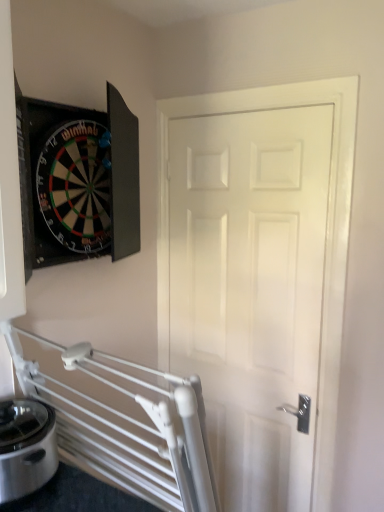
What is the approximate height of white glossy door at center?

The height of white glossy door at center is 6.07 feet.

Describe the element at coordinates (251, 291) in the screenshot. The height and width of the screenshot is (512, 384). I see `white glossy door at center` at that location.

Locate an element on the screen. The image size is (384, 512). white glossy door at center is located at coordinates (251, 291).

Find the location of `satin silver appliance at lower left`. satin silver appliance at lower left is located at coordinates (26, 447).

The height and width of the screenshot is (512, 384). Describe the element at coordinates (26, 447) in the screenshot. I see `satin silver appliance at lower left` at that location.

The image size is (384, 512). Identify the location of white glossy door at center. (251, 291).

Based on their positions, is white glossy door at center located to the left or right of satin silver appliance at lower left?

From the image, it's evident that white glossy door at center is to the right of satin silver appliance at lower left.

Which object is closer to the camera taking this photo, white glossy door at center or satin silver appliance at lower left?

Positioned in front is satin silver appliance at lower left.

Does point (268, 423) come farther from viewer compared to point (0, 499)?

Yes, it is.

From the image's perspective, is white glossy door at center under satin silver appliance at lower left?

Actually, white glossy door at center appears above satin silver appliance at lower left in the image.

From a real-world perspective, is white glossy door at center physically below satin silver appliance at lower left?

No.

Does white glossy door at center have a greater width compared to satin silver appliance at lower left?

In fact, white glossy door at center might be narrower than satin silver appliance at lower left.

In terms of height, does white glossy door at center look taller or shorter compared to satin silver appliance at lower left?

white glossy door at center is taller than satin silver appliance at lower left.

Consider the image. Can you confirm if white glossy door at center is bigger than satin silver appliance at lower left?

Yes, white glossy door at center is bigger than satin silver appliance at lower left.

Is white glossy door at center surrounding satin silver appliance at lower left?

No.

Is white glossy door at center beside satin silver appliance at lower left?

No, white glossy door at center is not next to satin silver appliance at lower left.

Is white glossy door at center oriented towards satin silver appliance at lower left?

Yes, white glossy door at center is oriented towards satin silver appliance at lower left.

How many degrees apart are the facing directions of white glossy door at center and satin silver appliance at lower left?

87.8 degrees.

Locate an element on the screen. The height and width of the screenshot is (512, 384). door that is above the satin silver appliance at lower left (from a real-world perspective) is located at coordinates (251, 291).

Which object is positioned more to the right, satin silver appliance at lower left or white glossy door at center?

white glossy door at center is more to the right.

Is satin silver appliance at lower left behind white glossy door at center?

No, satin silver appliance at lower left is closer to the camera.

Considering the positions of point (27, 421) and point (330, 116), is point (27, 421) closer or farther from the camera than point (330, 116)?

Point (27, 421) is positioned closer to the camera compared to point (330, 116).

From the image's perspective, is satin silver appliance at lower left positioned above or below white glossy door at center?

satin silver appliance at lower left is below white glossy door at center.

From a real-world perspective, is satin silver appliance at lower left below white glossy door at center?

Yes, from a real-world perspective, satin silver appliance at lower left is beneath white glossy door at center.

Which object is thinner, satin silver appliance at lower left or white glossy door at center?

white glossy door at center is thinner.

Which of these two, satin silver appliance at lower left or white glossy door at center, stands taller?

white glossy door at center.

Can you confirm if satin silver appliance at lower left is smaller than white glossy door at center?

Correct, satin silver appliance at lower left occupies less space than white glossy door at center.

Would you say satin silver appliance at lower left is inside or outside white glossy door at center?

satin silver appliance at lower left is located beyond the bounds of white glossy door at center.

Is satin silver appliance at lower left not near white glossy door at center?

satin silver appliance at lower left is near white glossy door at center, not far away.

Is satin silver appliance at lower left oriented away from white glossy door at center?

No, satin silver appliance at lower left is not facing away from white glossy door at center.

How many degrees apart are the facing directions of satin silver appliance at lower left and white glossy door at center?

The angle between the facing direction of satin silver appliance at lower left and the facing direction of white glossy door at center is 87.8 degrees.

You are a GUI agent. You are given a task and a screenshot of the screen. Output one action in this format:
    pyautogui.click(x=<x>, y=<y>)
    Task: Click on the door that appears above the satin silver appliance at lower left (from the image's perspective)
    This screenshot has width=384, height=512.
    Given the screenshot: What is the action you would take?
    pyautogui.click(x=251, y=291)

Identify the location of door that is on the right side of satin silver appliance at lower left. The image size is (384, 512). (251, 291).

Find the location of a particular element. This screenshot has height=512, width=384. door located above the satin silver appliance at lower left (from a real-world perspective) is located at coordinates (251, 291).